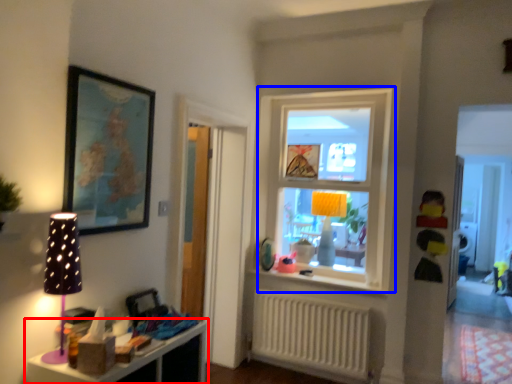
Question: Which point is closer to the camera, shelf (highlighted by a red box) or window (highlighted by a blue box)?

Choices:
 (A) shelf
 (B) window

Answer: (A)